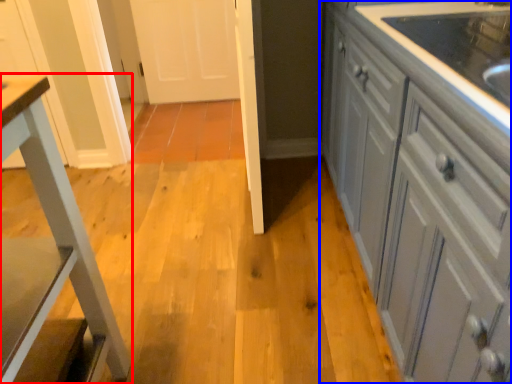
Question: Which of the following is the farthest to the observer, furniture (highlighted by a red box) or cabinetry (highlighted by a blue box)?

Choices:
 (A) furniture
 (B) cabinetry

Answer: (A)